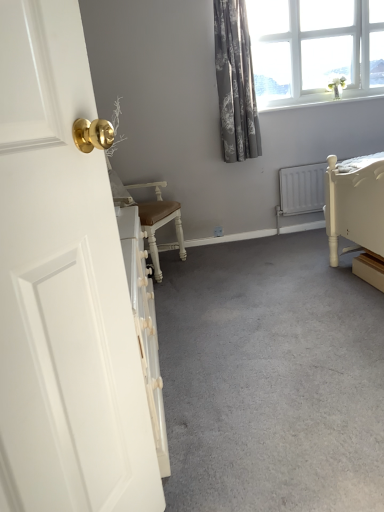
Question: Looking at the image, does white glossy door at left seem bigger or smaller compared to white glass window at upper right?

Choices:
 (A) small
 (B) big

Answer: (A)

Question: In terms of height, does white glossy door at left look taller or shorter compared to white glass window at upper right?

Choices:
 (A) short
 (B) tall

Answer: (B)

Question: Which is farther from the gray carpet at center?

Choices:
 (A) white glass window at upper right
 (B) gray floral fabric curtain at upper right
 (C) white glossy door at left

Answer: (A)

Question: Which is farther from the white glossy door at left?

Choices:
 (A) white glass window at upper right
 (B) gray carpet at center
 (C) gray floral fabric curtain at upper right

Answer: (A)